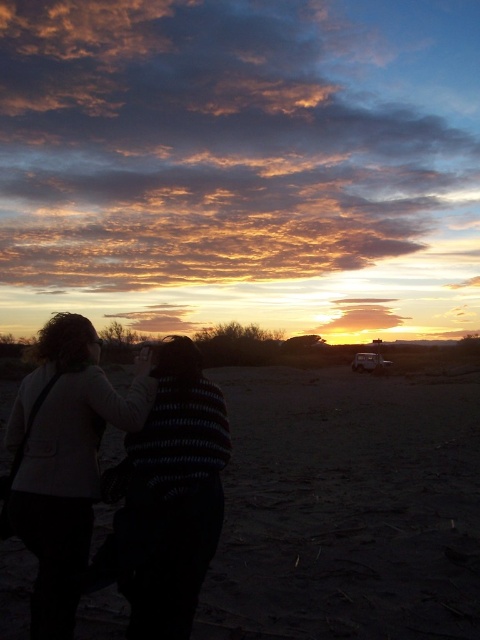
In the scene shown: Between dark sand at lower center and striped sweater at center, which one has less height?

striped sweater at center

Can you confirm if dark sand at lower center is wider than striped sweater at center?

Yes.

Locate an element on the screen. dark sand at lower center is located at coordinates (347, 508).

Which is in front, point (48, 376) or point (160, 493)?

Point (160, 493) is in front.

Is striped sweater at lower center further to camera compared to striped sweater at center?

That is True.

Is point (39, 605) more distant than point (192, 454)?

Yes.

Identify the location of striped sweater at lower center. The height and width of the screenshot is (640, 480). (69, 458).

Does dark sand at lower center have a greater height compared to striped sweater at lower center?

In fact, dark sand at lower center may be shorter than striped sweater at lower center.

Locate an element on the screen. The image size is (480, 640). dark sand at lower center is located at coordinates (347, 508).

This screenshot has width=480, height=640. Identify the location of dark sand at lower center. (347, 508).